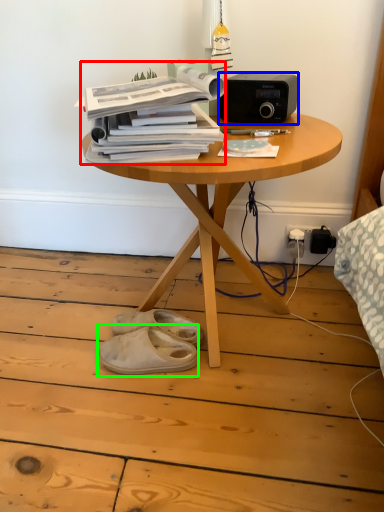
Question: Which object is the farthest from paperback book (highlighted by a red box)? Choose among these: stereo (highlighted by a blue box) or footwear (highlighted by a green box).

Choices:
 (A) stereo
 (B) footwear

Answer: (B)